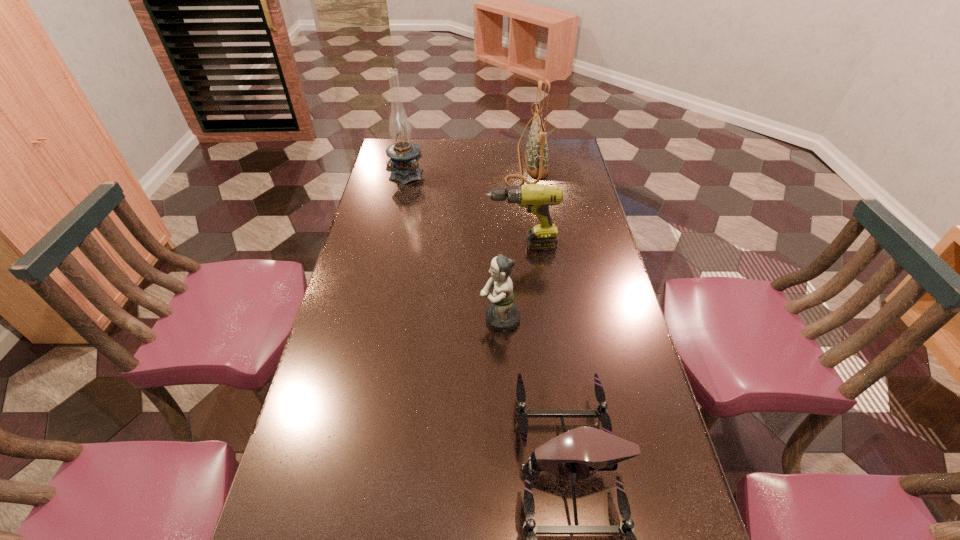
Where is `oil lamp`? Image resolution: width=960 pixels, height=540 pixels. oil lamp is located at coordinates (404, 154).

Locate an element on the screen. Image resolution: width=960 pixels, height=540 pixels. the tallest object is located at coordinates (404, 154).

Locate an element on the screen. The height and width of the screenshot is (540, 960). handbag is located at coordinates (536, 154).

This screenshot has height=540, width=960. I want to click on drill, so click(x=537, y=198).

Locate an element on the screen. This screenshot has width=960, height=540. the fourth farthest object is located at coordinates (502, 315).

Locate an element on the screen. This screenshot has width=960, height=540. vacant region located on the front of the oil lamp is located at coordinates (x=395, y=227).

The height and width of the screenshot is (540, 960). Identify the location of vacant area situated on the front-facing side of the second tallest object. (473, 164).

Locate an element on the screen. vacant area situated on the front-facing side of the second tallest object is located at coordinates (432, 164).

The image size is (960, 540). I want to click on blank space located on the front-facing side of the second tallest object, so click(x=418, y=164).

Find the location of a particular element. Image resolution: width=960 pixels, height=540 pixels. free space located 0.090m on the handle side of the third nearest object is located at coordinates (459, 246).